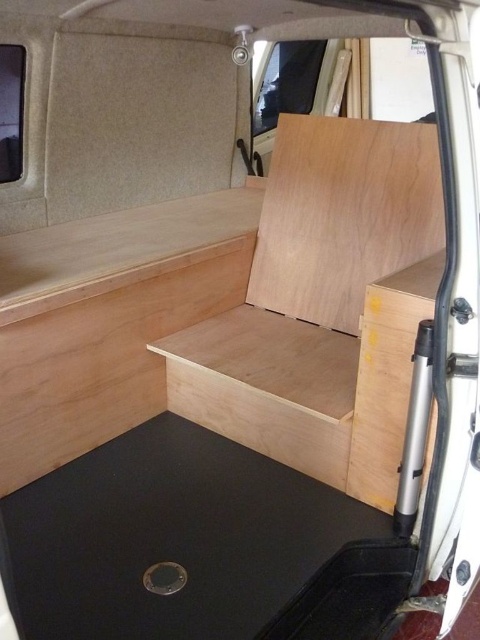
Question: Is black rubber mat at lower left smaller than natural wood plywood at lower left?

Choices:
 (A) no
 (B) yes

Answer: (B)

Question: Observing the image, what is the correct spatial positioning of black rubber mat at lower left in reference to natural wood plywood at center?

Choices:
 (A) below
 (B) above

Answer: (A)

Question: Among these objects, which one is nearest to the camera?

Choices:
 (A) black rubber mat at lower left
 (B) natural wood plywood at center
 (C) natural wood plywood at lower left

Answer: (A)

Question: Which point is farther to the camera?

Choices:
 (A) black rubber mat at lower left
 (B) natural wood plywood at lower left
 (C) natural wood plywood at center

Answer: (C)

Question: Does natural wood plywood at lower left have a larger size compared to natural wood plywood at center?

Choices:
 (A) no
 (B) yes

Answer: (B)

Question: Which point is farther from the camera taking this photo?

Choices:
 (A) (155, 371)
 (B) (388, 154)
 (C) (74, 516)

Answer: (A)